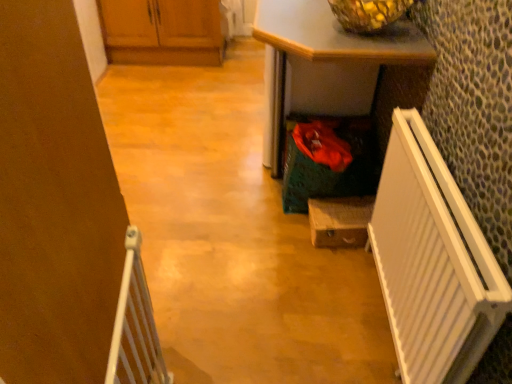
You are a GUI agent. You are given a task and a screenshot of the screen. Output one action in this format:
    pyautogui.click(x=<x>, y=<y>)
    Task: Click on the vacant area that lies between wooden cabinets at upper left, the 1th cabinetry when ordered from back to front, and white plastic radiator at right, the second radiator viewed from the left
    
    Given the screenshot: What is the action you would take?
    pyautogui.click(x=213, y=140)